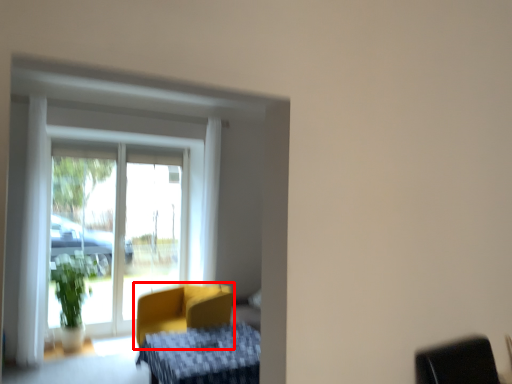
Question: From the image's perspective, where is chair (annotated by the red box) located in relation to furniture in the image?

Choices:
 (A) above
 (B) below

Answer: (A)